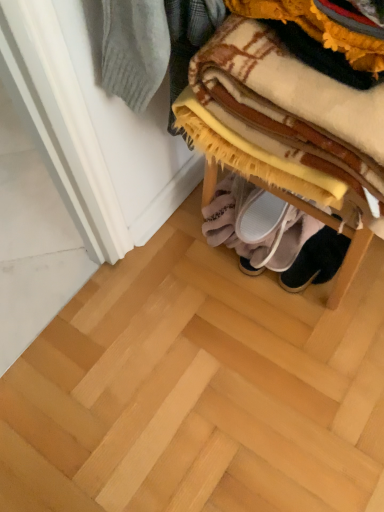
Question: Is white fabric slipper at lower center, positioned as the 1th footwear in left-to-right order, not close to wooden shoe rack at lower right?

Choices:
 (A) no
 (B) yes

Answer: (A)

Question: Does white fabric slipper at lower center, which ranks as the second footwear in right-to-left order, appear on the right side of wooden shoe rack at lower right?

Choices:
 (A) no
 (B) yes

Answer: (B)

Question: Is white fabric slipper at lower center, which ranks as the second footwear in right-to-left order, smaller than wooden shoe rack at lower right?

Choices:
 (A) yes
 (B) no

Answer: (A)

Question: From the image's perspective, is white fabric slipper at lower center, which ranks as the second footwear in right-to-left order, on top of wooden shoe rack at lower right?

Choices:
 (A) no
 (B) yes

Answer: (B)

Question: Is white fabric slipper at lower center, which ranks as the second footwear in right-to-left order, oriented towards wooden shoe rack at lower right?

Choices:
 (A) no
 (B) yes

Answer: (B)

Question: Does white fabric slipper at lower center, positioned as the 1th footwear in left-to-right order, have a greater width compared to wooden shoe rack at lower right?

Choices:
 (A) no
 (B) yes

Answer: (A)

Question: Is plaid fabric blanket at upper right closer to camera compared to wooden shoe rack at lower right?

Choices:
 (A) no
 (B) yes

Answer: (B)

Question: Considering the relative sizes of plaid fabric blanket at upper right and wooden shoe rack at lower right in the image provided, is plaid fabric blanket at upper right thinner than wooden shoe rack at lower right?

Choices:
 (A) yes
 (B) no

Answer: (A)

Question: Does plaid fabric blanket at upper right turn towards wooden shoe rack at lower right?

Choices:
 (A) no
 (B) yes

Answer: (A)

Question: Can you confirm if plaid fabric blanket at upper right is shorter than wooden shoe rack at lower right?

Choices:
 (A) no
 (B) yes

Answer: (A)

Question: Is plaid fabric blanket at upper right touching wooden shoe rack at lower right?

Choices:
 (A) yes
 (B) no

Answer: (B)

Question: Is plaid fabric blanket at upper right at the right side of wooden shoe rack at lower right?

Choices:
 (A) yes
 (B) no

Answer: (A)

Question: From the image's perspective, is white fabric slipper at lower center, positioned as the 1th footwear in left-to-right order, located above plaid fabric blanket at upper right?

Choices:
 (A) no
 (B) yes

Answer: (A)